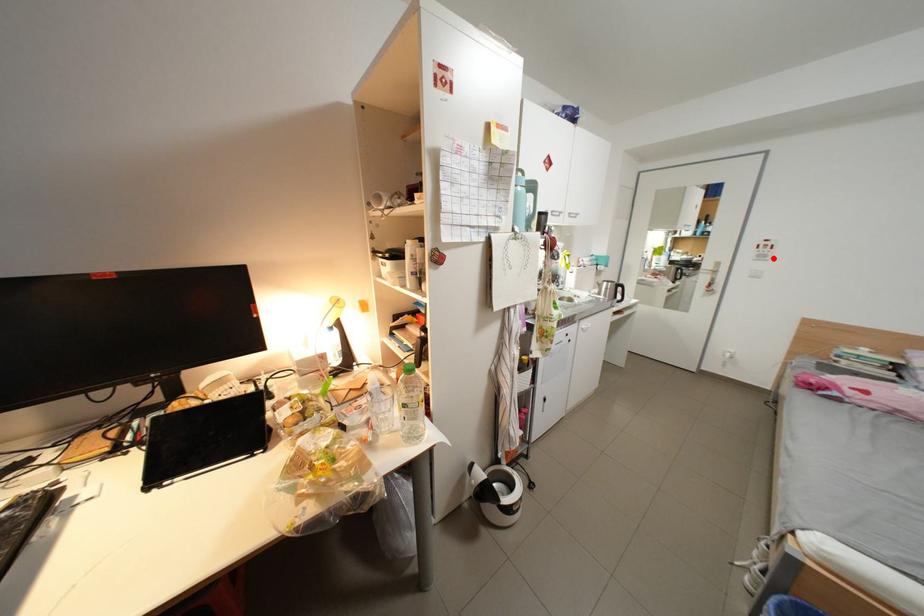
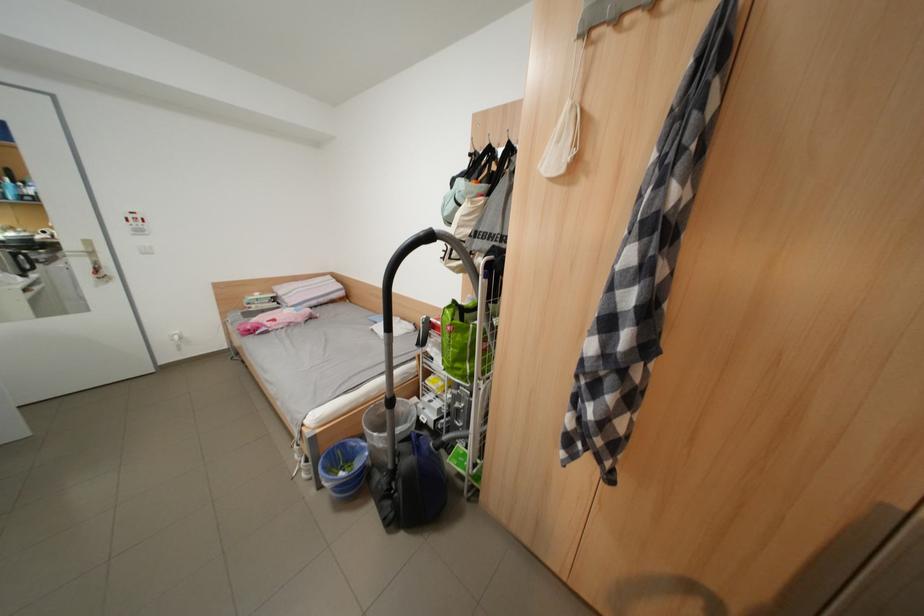
In the second image, find the point that corresponds to the highlighted location in the first image.

(152, 233)